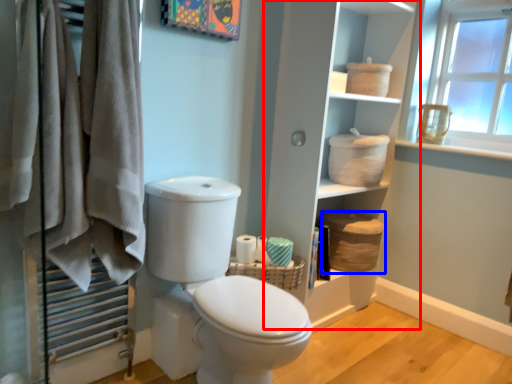
Question: Which object appears farthest to the camera in this image, bookshelf (highlighted by a red box) or basket (highlighted by a blue box)?

Choices:
 (A) bookshelf
 (B) basket

Answer: (B)